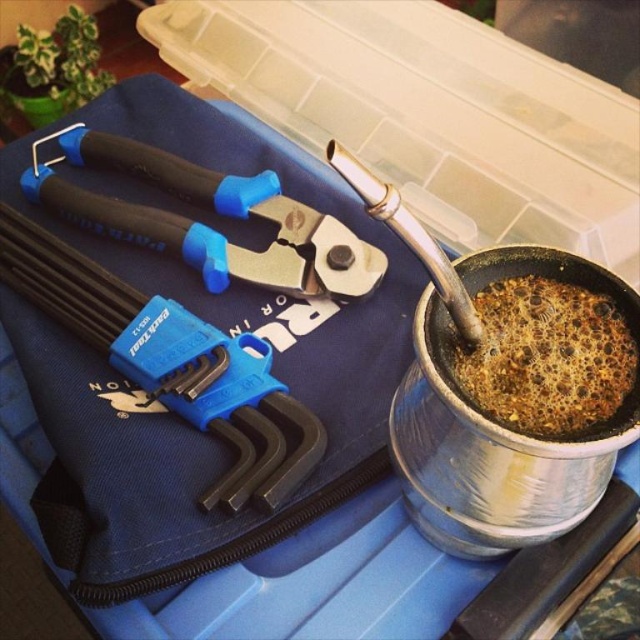
Question: Which of the following is the farthest from the observer?

Choices:
 (A) (509, 372)
 (B) (147, 364)
 (C) (164, 244)

Answer: (C)

Question: Is blue plastic hex key set at upper left thinner than black plastic pliers at upper left?

Choices:
 (A) no
 (B) yes

Answer: (B)

Question: Is black plastic pliers at upper left below brown matte coffee at right?

Choices:
 (A) no
 (B) yes

Answer: (A)

Question: Does blue plastic hex key set at upper left have a larger size compared to brown matte coffee at right?

Choices:
 (A) no
 (B) yes

Answer: (B)

Question: Estimate the real-world distances between objects in this image. Which object is farther from the blue plastic hex key set at upper left?

Choices:
 (A) black plastic pliers at upper left
 (B) brown matte coffee at right

Answer: (B)

Question: Estimate the real-world distances between objects in this image. Which object is farther from the blue plastic hex key set at upper left?

Choices:
 (A) brown matte coffee at right
 (B) black plastic pliers at upper left

Answer: (A)